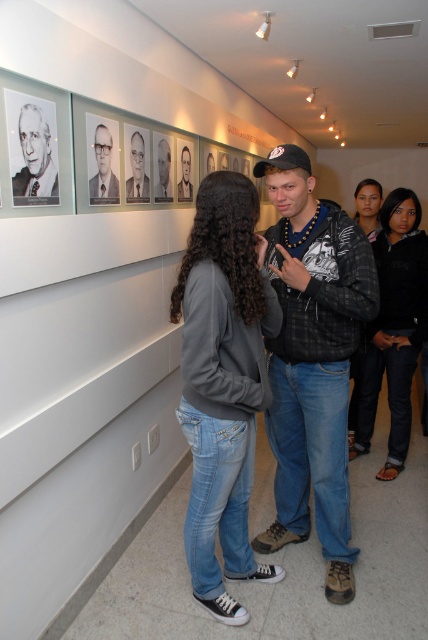
Question: Which of the following is the farthest from the observer?

Choices:
 (A) smooth black jacket at center
 (B) denim jeans at center
 (C) black leather jacket at center
 (D) dark gray sweater at right

Answer: (D)

Question: Which of the following is the farthest from the observer?

Choices:
 (A) dark gray sweater at right
 (B) black and white portrait at upper left
 (C) matte black suit at center

Answer: (A)

Question: Observing the image, what is the correct spatial positioning of black matte jacket at lower right in reference to black glossy photo frame at upper center?

Choices:
 (A) above
 (B) below

Answer: (B)

Question: Which of the following is the closest to the observer?

Choices:
 (A) black leather jacket at center
 (B) matte black suit at center
 (C) smooth black jacket at center
 (D) denim jeans at center

Answer: (D)

Question: Can you confirm if black and white portrait at upper left is bigger than smooth black suit at upper center?

Choices:
 (A) yes
 (B) no

Answer: (B)

Question: Does black glossy photo frame at upper center have a larger size compared to smooth black suit at upper center?

Choices:
 (A) yes
 (B) no

Answer: (A)